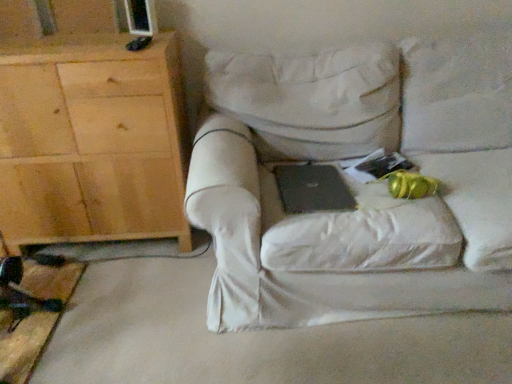
Question: In the image, is black matte laptop at center positioned in front of or behind light wood cabinet at left?

Choices:
 (A) front
 (B) behind

Answer: (A)

Question: Considering the positions of point (339, 201) and point (120, 140), is point (339, 201) closer or farther from the camera than point (120, 140)?

Choices:
 (A) farther
 (B) closer

Answer: (B)

Question: Which of these objects is positioned closest to the white fabric chair at center?

Choices:
 (A) light wood cabinet at left
 (B) black matte laptop at center

Answer: (B)

Question: Based on their relative distances, which object is farther from the black matte laptop at center?

Choices:
 (A) white fabric chair at center
 (B) light wood cabinet at left

Answer: (B)